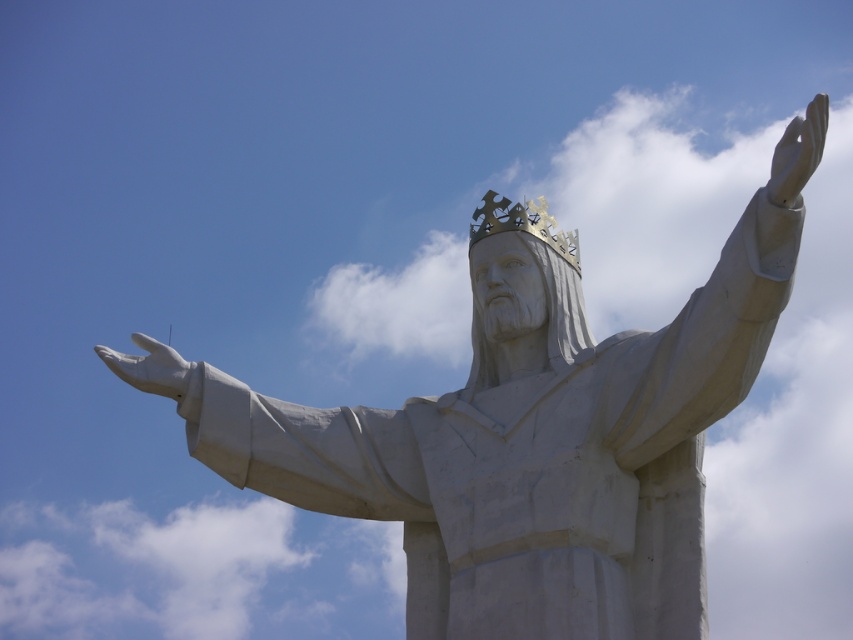
Question: Observing the image, what is the correct spatial positioning of gold metallic crown at center in reference to white matte hand at lower left?

Choices:
 (A) right
 (B) left

Answer: (A)

Question: Considering the real-world distances, which object is farthest from the white matte hand at upper right?

Choices:
 (A) gold metallic crown at center
 (B) white matte hand at lower left

Answer: (B)

Question: Which point is closer to the camera taking this photo?

Choices:
 (A) (822, 136)
 (B) (144, 339)
 (C) (517, 209)

Answer: (A)

Question: Among these points, which one is farthest from the camera?

Choices:
 (A) (572, 257)
 (B) (177, 380)
 (C) (793, 134)

Answer: (A)

Question: Can you confirm if white matte hand at upper right is wider than white matte hand at lower left?

Choices:
 (A) no
 (B) yes

Answer: (B)

Question: Considering the relative positions of white matte hand at upper right and gold metallic crown at center in the image provided, where is white matte hand at upper right located with respect to gold metallic crown at center?

Choices:
 (A) right
 (B) left

Answer: (A)